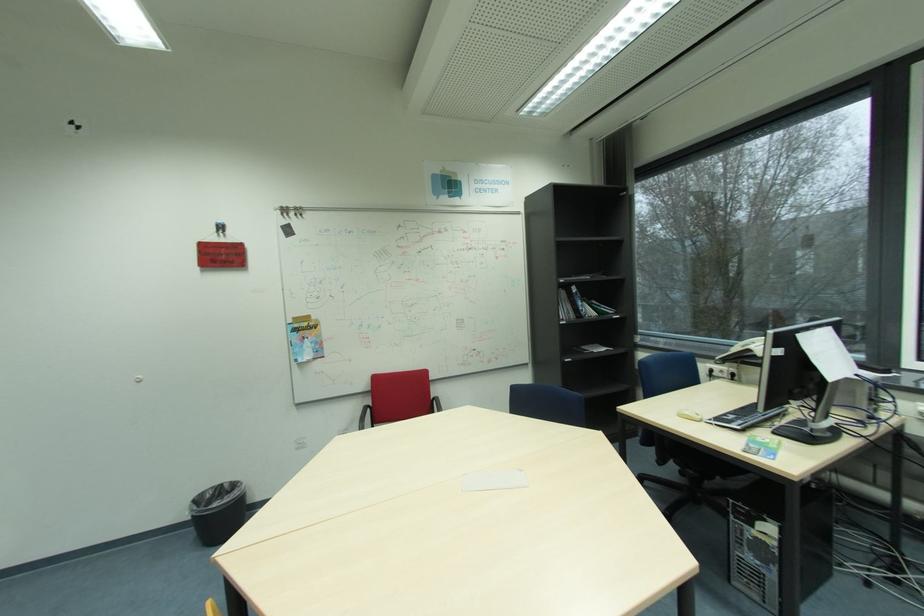
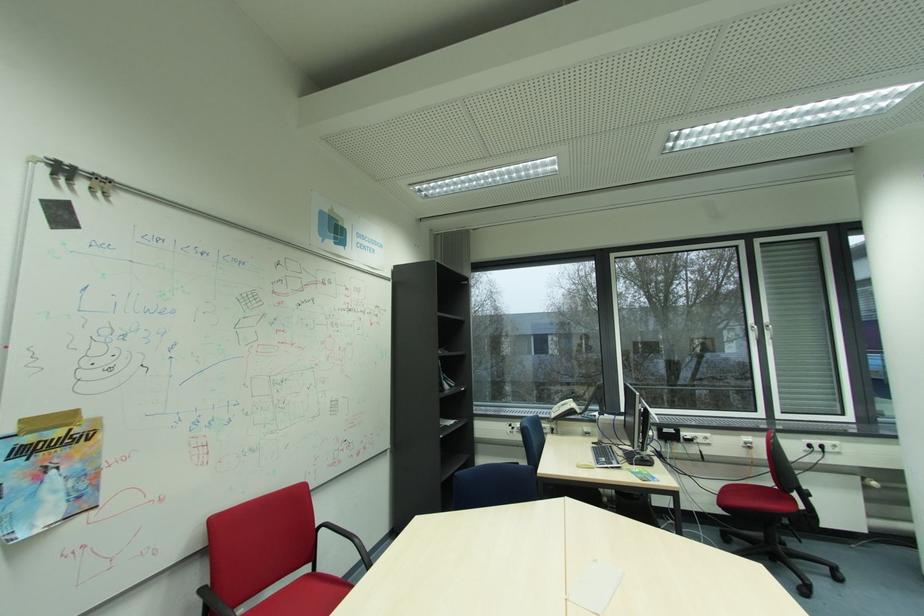
The point at [529,471] is marked in the first image. Where is the corresponding point in the second image?

(602, 562)